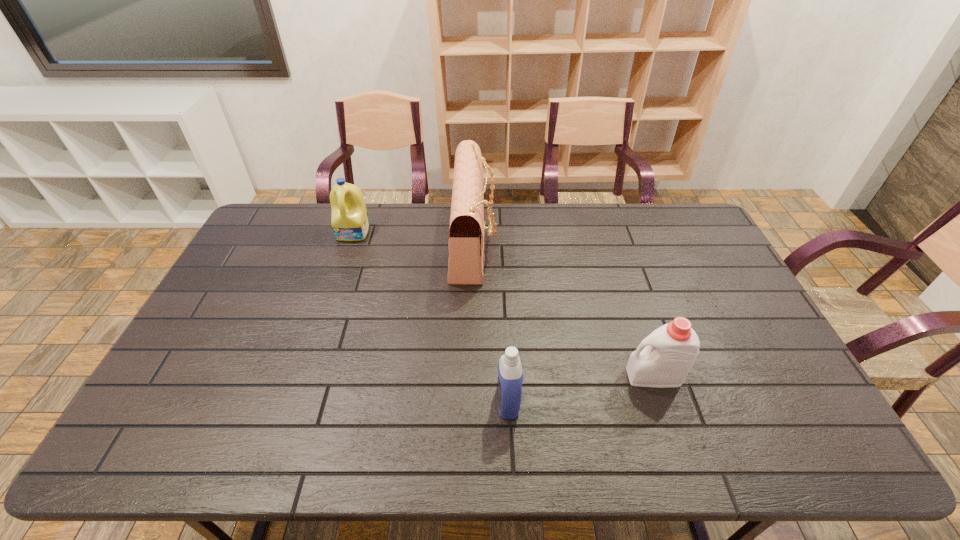
I want to click on vacant space that's between the second detergent from right to left and the leftmost object, so click(431, 318).

At what (x,y) coordinates should I click in order to perform the action: click on vacant space that is in between the tallest object and the leftmost object. Please return your answer as a coordinate pair (x, y). Looking at the image, I should click on (414, 237).

Identify the location of vacant point located between the handbag and the rightmost detergent. (564, 309).

Find the location of `free space between the rightmost object and the second detergent from left to right`. free space between the rightmost object and the second detergent from left to right is located at coordinates (581, 389).

Where is `free space between the rightmost detergent and the second detergent from right to left`? The image size is (960, 540). free space between the rightmost detergent and the second detergent from right to left is located at coordinates (581, 389).

This screenshot has height=540, width=960. Find the location of `free space between the second detergent from left to right and the tallest object`. free space between the second detergent from left to right and the tallest object is located at coordinates (491, 322).

Locate an element on the screen. vacant space that's between the leftmost object and the second detergent from left to right is located at coordinates (431, 318).

At what (x,y) coordinates should I click in order to perform the action: click on object that stands as the closest to the rightmost object. Please return your answer as a coordinate pair (x, y). Looking at the image, I should click on (510, 373).

Where is `the closest object relative to the tallest object`? the closest object relative to the tallest object is located at coordinates (349, 219).

Find the location of a particular element. The height and width of the screenshot is (540, 960). the second closest detergent to the farthest detergent is located at coordinates (663, 359).